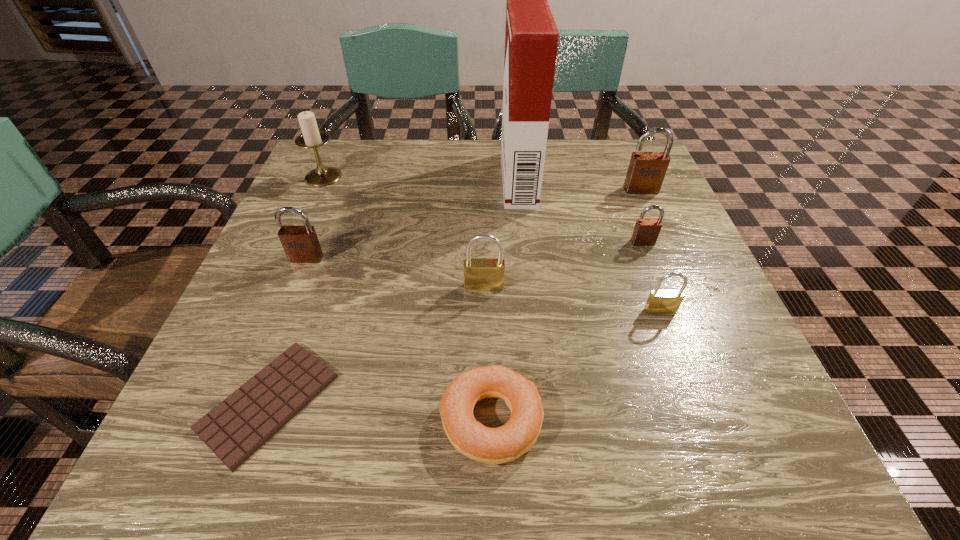
The image size is (960, 540). In order to click on the smaller brass padlock in this screenshot , I will do pyautogui.click(x=664, y=301).

Locate an element on the screen. This screenshot has height=540, width=960. the smallest brown padlock is located at coordinates (646, 231).

Where is `the fourth nearest padlock`? the fourth nearest padlock is located at coordinates (646, 231).

The image size is (960, 540). In order to click on the second shortest object in this screenshot , I will do `click(494, 446)`.

Identify the location of tan bagel. (494, 446).

Identify the location of the shortest object. (237, 427).

At what (x,y) coordinates should I click in order to perform the action: click on chocolate bar. Please return your answer as a coordinate pair (x, y). This screenshot has width=960, height=540. Looking at the image, I should click on (237, 427).

This screenshot has height=540, width=960. What are the coordinates of `vacant area located 0.090m on the front-facing side of the tallest object` in the screenshot? It's located at (464, 179).

The height and width of the screenshot is (540, 960). I want to click on vacant position located on the front-facing side of the tallest object, so click(x=407, y=179).

Locate an element on the screen. The image size is (960, 540). free space located 0.230m on the front-facing side of the tallest object is located at coordinates (402, 179).